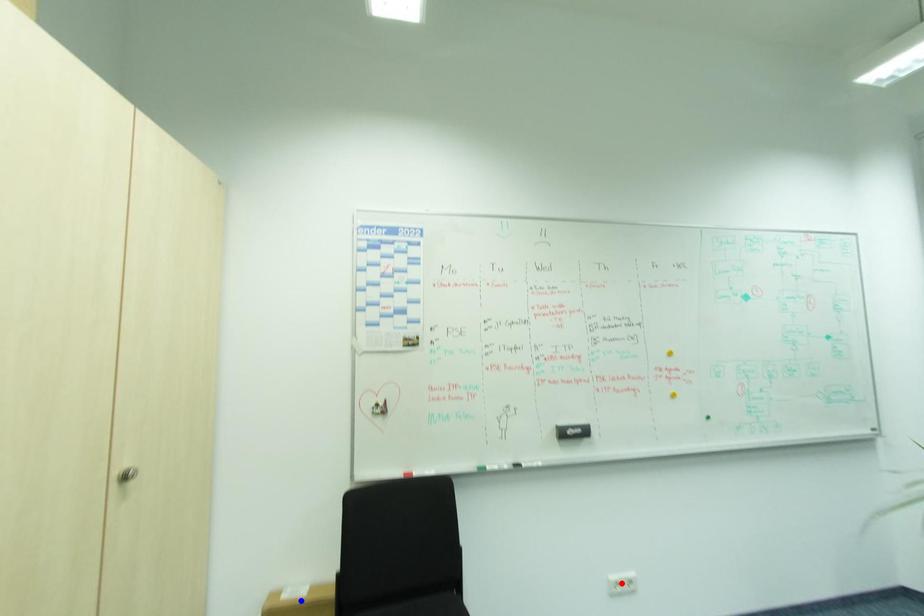
Question: Which of the two points in the image is closer to the camera?

Choices:
 (A) Blue point is closer.
 (B) Red point is closer.

Answer: (A)